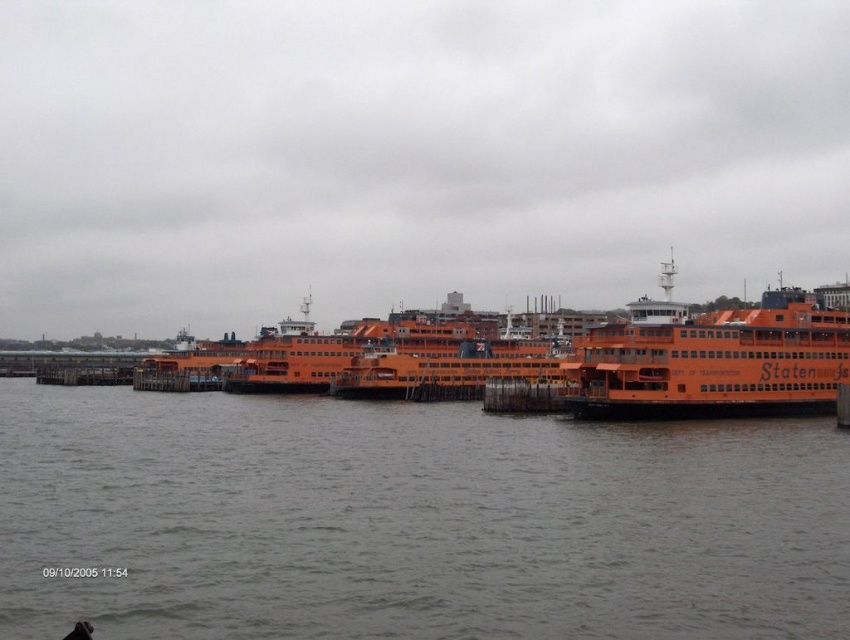
Between gray water at lower center and orange matte ferry at center, which one has less height?

Standing shorter between the two is gray water at lower center.

Between point (547, 545) and point (484, 339), which one is positioned in front?

Point (547, 545) is more forward.

Who is more forward, (57, 472) or (469, 376)?

Point (57, 472) is in front.

Find the location of a particular element. The height and width of the screenshot is (640, 850). gray water at lower center is located at coordinates (411, 522).

Who is lower down, orange matte ferry at right or orange matte ferry at center?

Positioned lower is orange matte ferry at center.

Based on the photo, is orange matte ferry at right above orange matte ferry at center?

Correct, orange matte ferry at right is located above orange matte ferry at center.

Image resolution: width=850 pixels, height=640 pixels. In order to click on orange matte ferry at right in this screenshot , I will do `click(711, 358)`.

Measure the distance from gray water at lower center to orange matte ferry at right.

A distance of 17.82 meters exists between gray water at lower center and orange matte ferry at right.

Is gray water at lower center positioned at the back of orange matte ferry at right?

No.

Is point (698, 444) closer to viewer compared to point (790, 332)?

That is True.

Locate an element on the screen. The height and width of the screenshot is (640, 850). gray water at lower center is located at coordinates (411, 522).